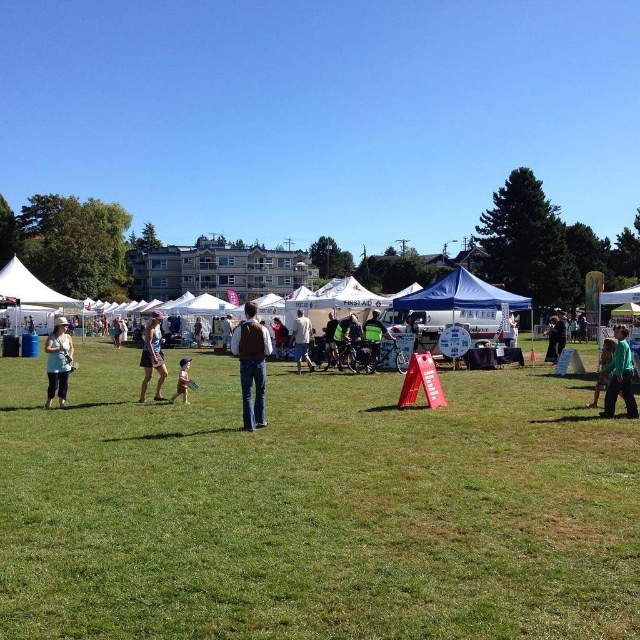
Which is more to the right, green matte shirt at right or matte blue dress at left?

From the viewer's perspective, green matte shirt at right appears more on the right side.

Does green matte shirt at right have a lesser height compared to matte blue dress at left?

Yes, green matte shirt at right is shorter than matte blue dress at left.

In order to click on green matte shirt at right in this screenshot , I will do `click(620, 376)`.

The height and width of the screenshot is (640, 640). In order to click on green matte shirt at right in this screenshot , I will do `click(620, 376)`.

Who is higher up, matte blue dress at left or green fabric shirt at right?

matte blue dress at left

Who is lower down, matte blue dress at left or green fabric shirt at right?

Positioned lower is green fabric shirt at right.

Is point (51, 333) farther from viewer compared to point (600, 374)?

Yes.

This screenshot has width=640, height=640. I want to click on matte blue dress at left, so click(x=58, y=362).

Does white tent at left have a greater width compared to green matte shirt at right?

Indeed, white tent at left has a greater width compared to green matte shirt at right.

Is point (19, 291) closer to camera compared to point (636, 413)?

No, (19, 291) is behind (636, 413).

This screenshot has width=640, height=640. What are the coordinates of `white tent at left` in the screenshot? It's located at (29, 289).

You are a GUI agent. You are given a task and a screenshot of the screen. Output one action in this format:
    pyautogui.click(x=<x>, y=<y>)
    Task: Click on the white tent at left
    The width and height of the screenshot is (640, 640).
    Given the screenshot: What is the action you would take?
    pyautogui.click(x=29, y=289)